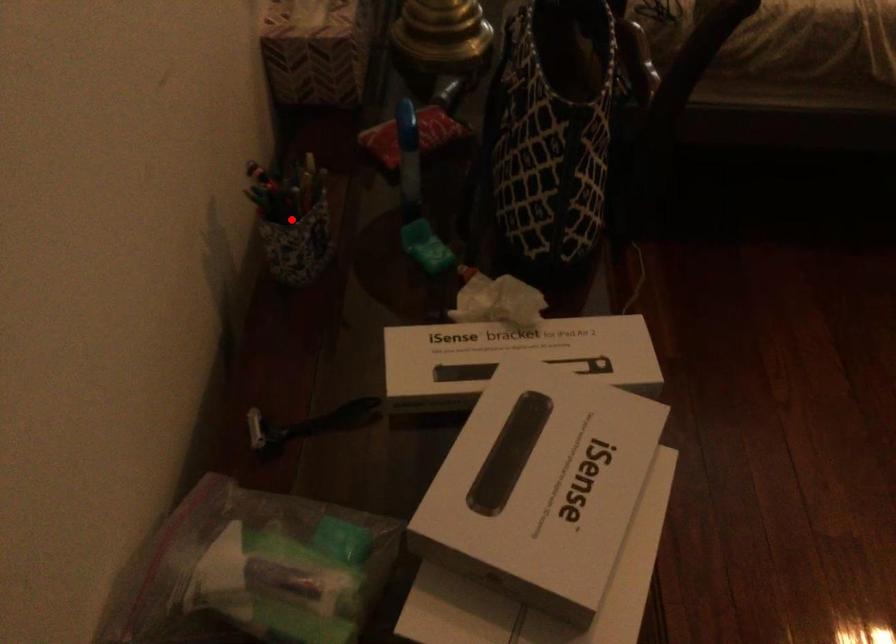
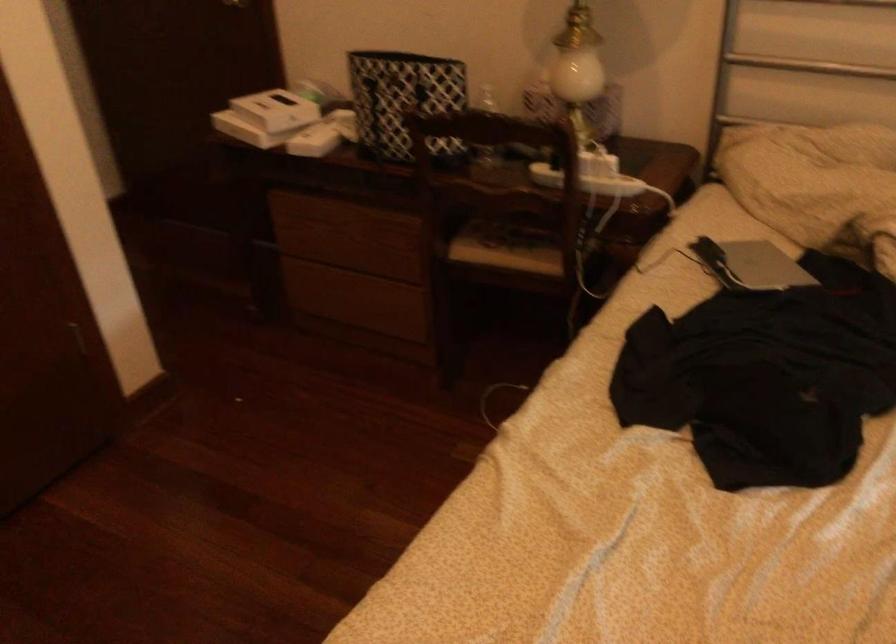
Question: I am providing you with two images of the same scene from different viewpoints. A red point is marked on the first image. Is the red point's position out of view in image 2?

Choices:
 (A) Yes
 (B) No

Answer: (A)